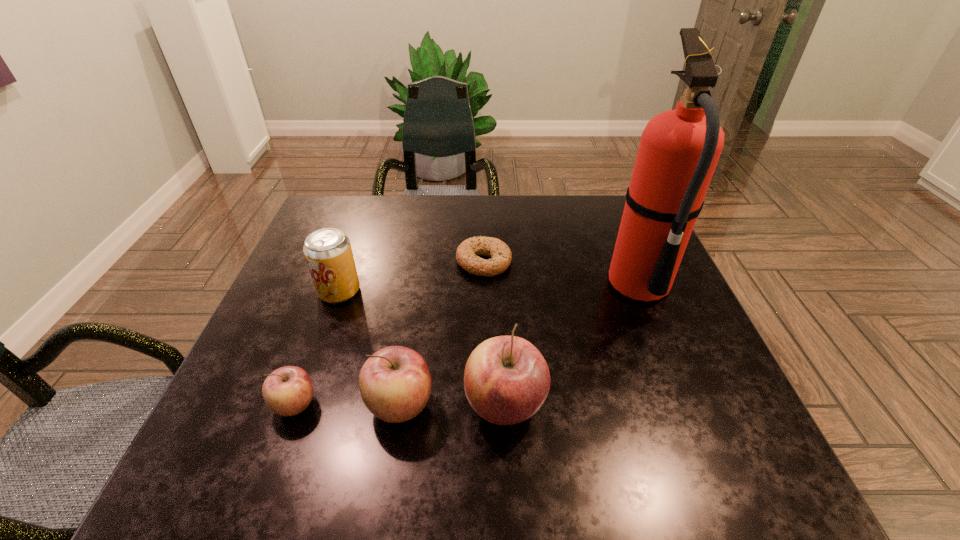
The height and width of the screenshot is (540, 960). Identify the location of vacant space located on the back of the second apple from left to right. (415, 311).

Locate an element on the screen. This screenshot has height=540, width=960. free region located on the left of the rightmost apple is located at coordinates (336, 405).

This screenshot has width=960, height=540. Identify the location of vacant space located 0.190m at the nozzle of the tallest object. (529, 285).

In order to click on vacant space located at the nozzle of the tallest object in this screenshot , I will do [475, 285].

This screenshot has height=540, width=960. I want to click on vacant position located 0.190m at the nozzle of the tallest object, so click(529, 285).

Find the location of `vacant region located 0.390m on the back of the pop (soda)`. vacant region located 0.390m on the back of the pop (soda) is located at coordinates (372, 196).

At what (x,y) coordinates should I click in order to perform the action: click on vacant space located on the right of the shortest object. Please return your answer as a coordinate pair (x, y). Image resolution: width=960 pixels, height=540 pixels. Looking at the image, I should click on (624, 262).

Where is `apple that is positioned at the left edge`? apple that is positioned at the left edge is located at coordinates [x=287, y=391].

Identify the location of pop (soda) that is at the left edge. (328, 253).

Find the location of a particular element. The height and width of the screenshot is (540, 960). object situated at the right edge is located at coordinates (679, 149).